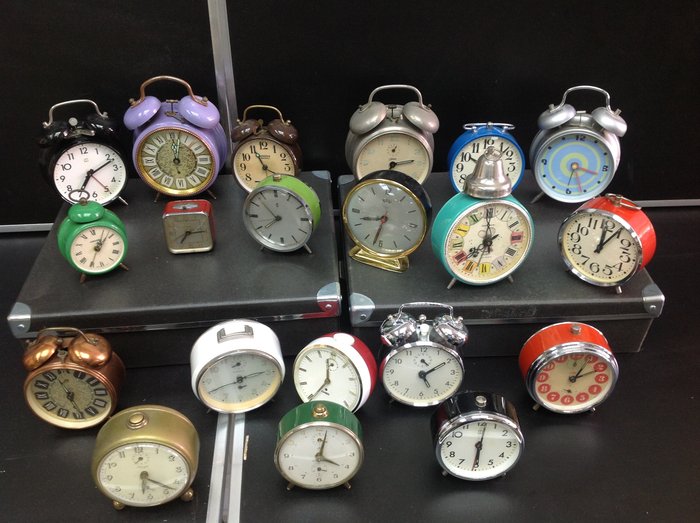
This screenshot has width=700, height=523. I want to click on silver clock, so click(586, 118), click(426, 320), click(491, 406).